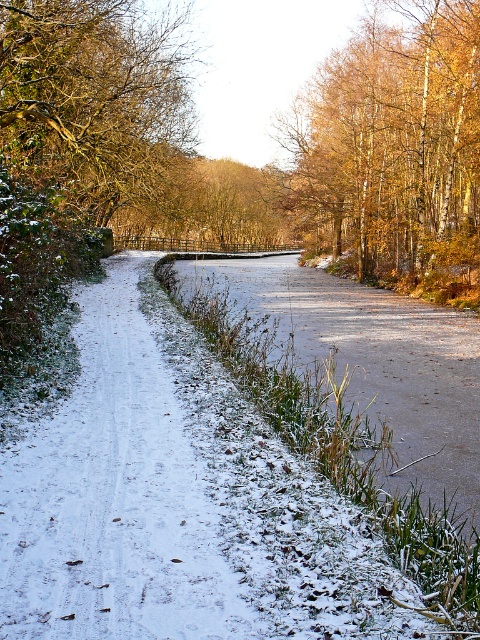
Question: Which point is farther to the camera?

Choices:
 (A) (317, 282)
 (B) (35, 177)
 (C) (391, 65)

Answer: (A)

Question: Is brown leafy tree at upper left in front of snowy grass at center?

Choices:
 (A) yes
 (B) no

Answer: (B)

Question: Which point appears farthest from the camera in this image?

Choices:
 (A) (467, 369)
 (B) (348, 81)

Answer: (B)

Question: Is brown leafy tree at upper left positioned behind snowy grass at center?

Choices:
 (A) no
 (B) yes

Answer: (B)

Question: In this image, where is brown leafy tree at upper left located relative to snowy grass at center?

Choices:
 (A) below
 (B) above

Answer: (B)

Question: Which point is farther from the camera taking this photo?

Choices:
 (A) (359, 358)
 (B) (22, 173)

Answer: (A)